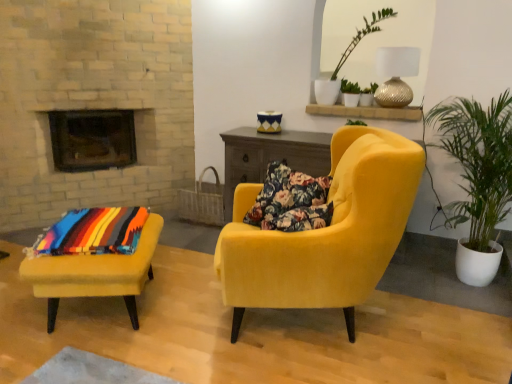
Locate an element on the screen. The width and height of the screenshot is (512, 384). vacant space that is in between velvet yellow armchair at center, which ranks as the 2th chair in left-to-right order, and velvet yellow ottoman at lower left, which is the 1th chair in left-to-right order is located at coordinates (170, 318).